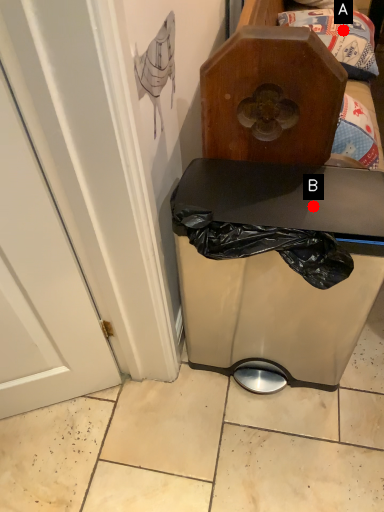
Question: Two points are circled on the image, labeled by A and B beside each circle. Which point is farther to the camera?

Choices:
 (A) A is further
 (B) B is further

Answer: (A)